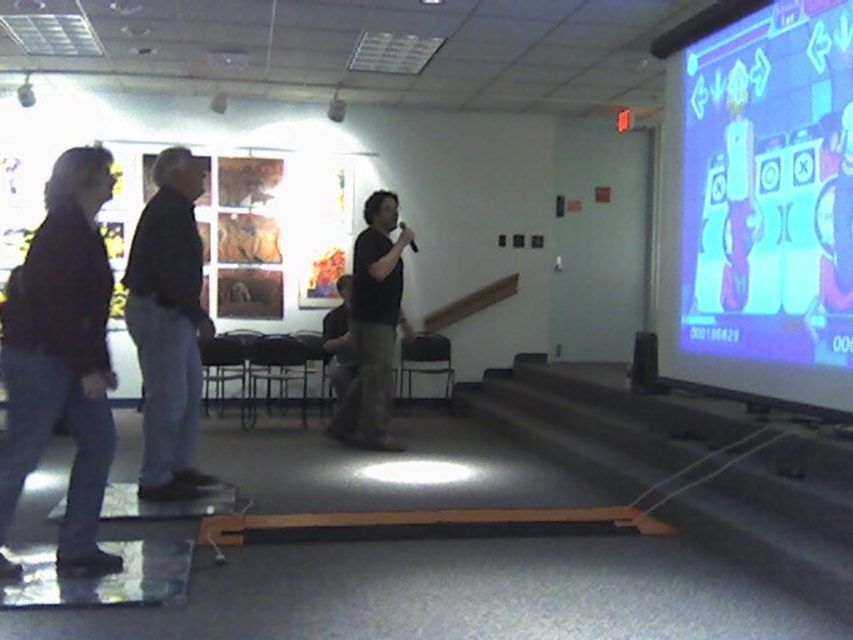
Is matte blue screen at upper right positioned in front of black matte shirt at center?

That is True.

Which is more to the right, matte blue screen at upper right or black matte shirt at center?

From the viewer's perspective, matte blue screen at upper right appears more on the right side.

Describe the element at coordinates (759, 208) in the screenshot. I see `matte blue screen at upper right` at that location.

Locate an element on the screen. matte blue screen at upper right is located at coordinates (759, 208).

Between point (837, 256) and point (155, 209), which one is positioned behind?

The point (155, 209) is more distant.

Between matte blue screen at upper right and black cotton shirt at left, which one appears on the left side from the viewer's perspective?

From the viewer's perspective, black cotton shirt at left appears more on the left side.

Does point (711, 385) come in front of point (161, 492)?

No, it is behind (161, 492).

The image size is (853, 640). In order to click on matte blue screen at upper right in this screenshot , I will do (x=759, y=208).

Between dark brown leather jacket at left and black matte shirt at center, which one has more height?

black matte shirt at center is taller.

Is dark brown leather jacket at left thinner than black matte shirt at center?

Yes, dark brown leather jacket at left is thinner than black matte shirt at center.

Which is in front, point (15, 349) or point (386, 316)?

Point (15, 349)

Locate an element on the screen. This screenshot has width=853, height=640. dark brown leather jacket at left is located at coordinates point(62,355).